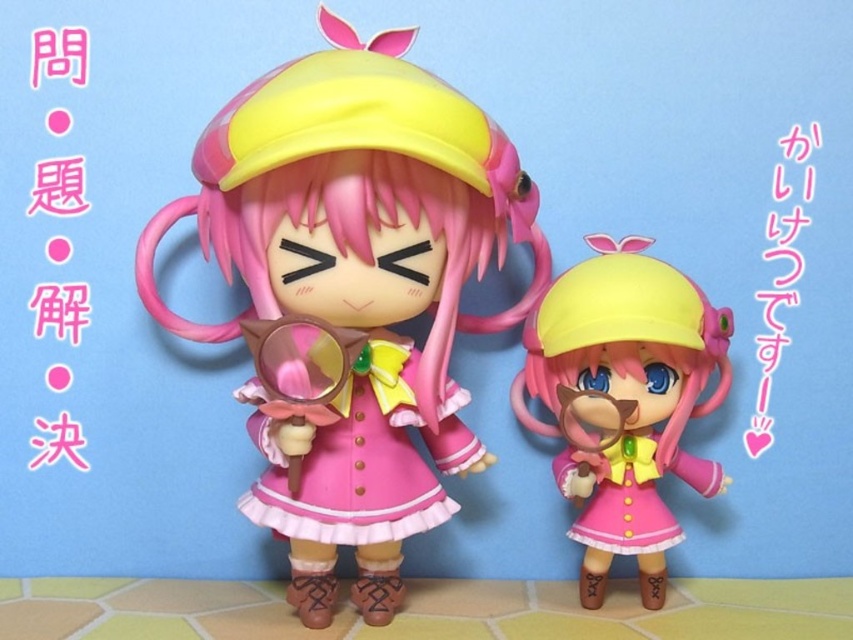
You are an artist trying to sketch the scene. You need to place the matte pink dress at center and the matte pink plastic toy at center accurately. Based on the scene description, which object should be drawn first if you want to follow the left to right drawing order?

The matte pink dress at center should be drawn first because it is positioned to the left of the matte pink plastic toy at center, following the left to right drawing order.

You are an artist trying to arrange two dresses in a display case. The matte pink dress at center and the pink satin dress at center are both placed in the case. Based on the scene description, which dress should you place on the shelf above the other to maintain their relative sizes?

The matte pink dress at center is much taller than the pink satin dress at center, so you should place the matte pink dress at center on the shelf above the pink satin dress at center to maintain their relative sizes.